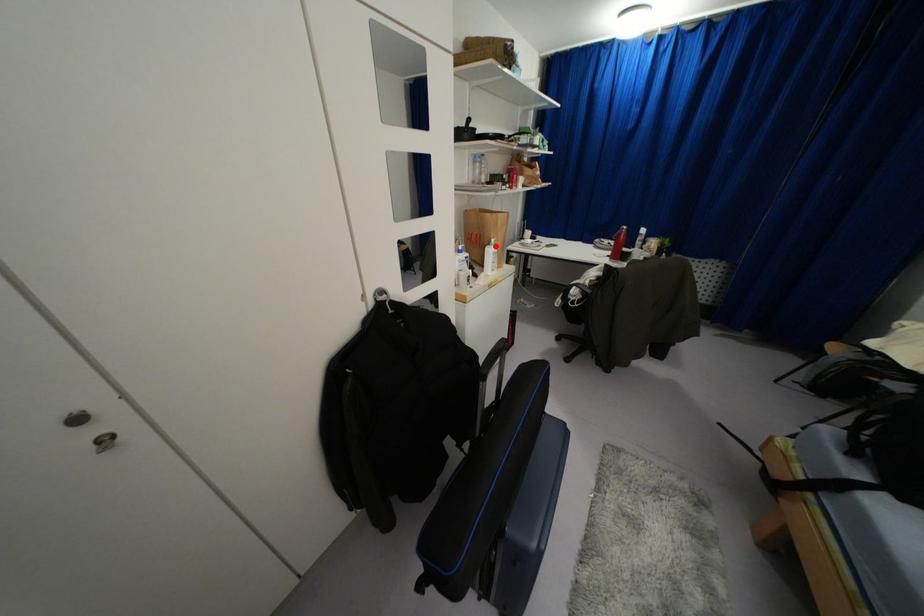
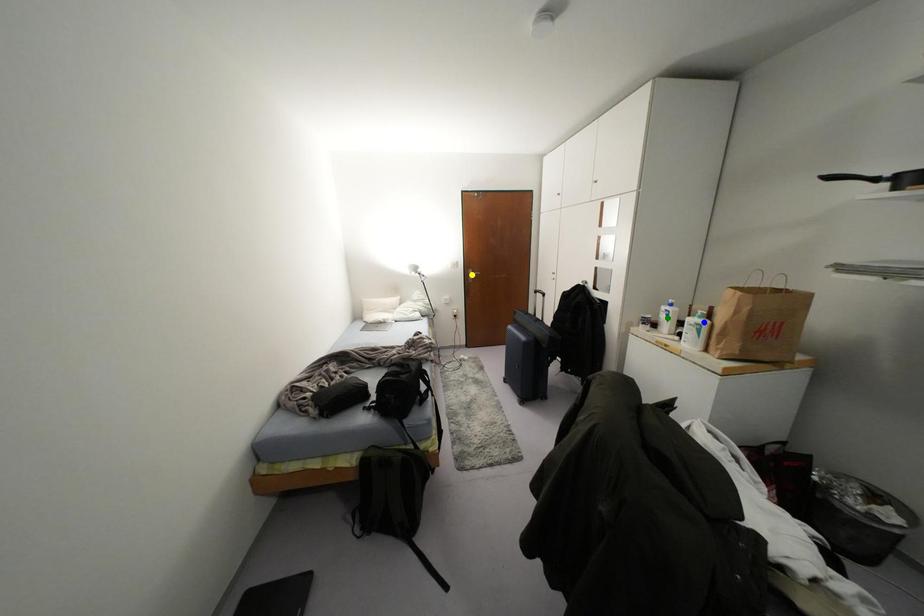
Question: I am providing you with two images of the same scene from different viewpoints. A red point is marked on the first image. You are given multiple points on the second image. Can you choose the point in image 2 that corresponds to the point in image 1?

Choices:
 (A) blue point
 (B) yellow point
 (C) green point

Answer: (A)